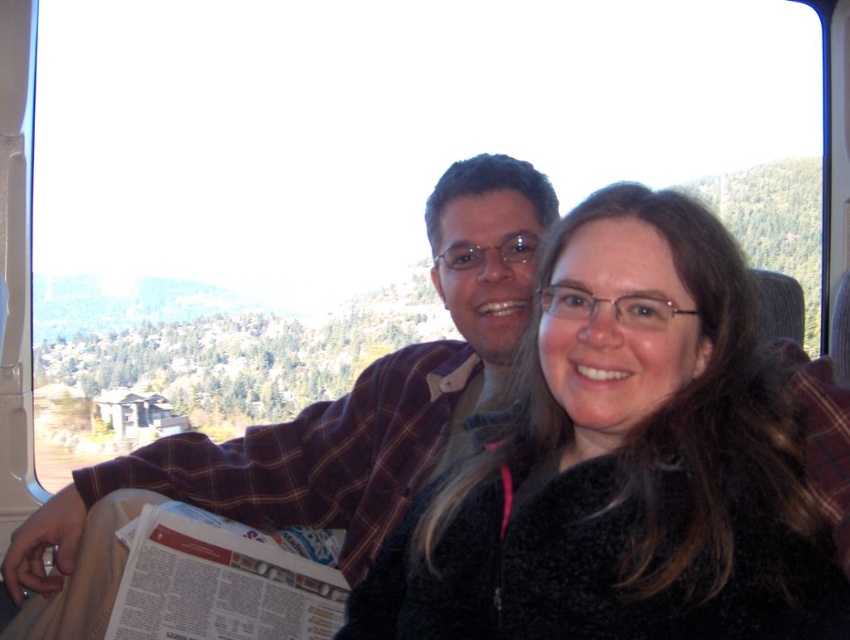
You are a photographer trying to capture a clear photo of the black fuzzy jacket at center and the plaid fabric shirt at center. Which object should you focus on first to ensure both are in focus?

You should focus on the black fuzzy jacket at center first because it is closer to the viewer than the plaid fabric shirt at center, so adjusting focus from near to far will help both be in focus.